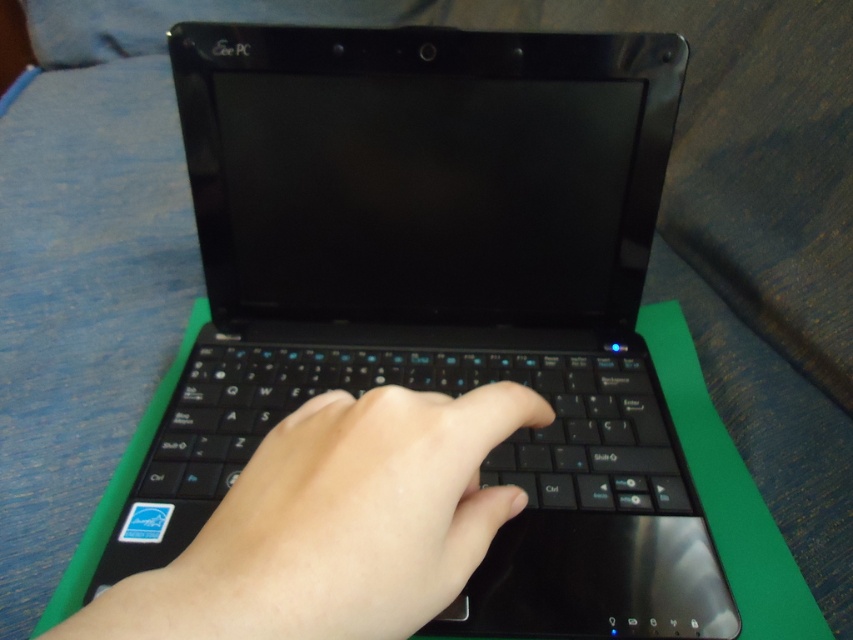
Is matte black hand at center further to the viewer compared to black matte keyboard at center?

That is False.

Which is in front, point (421, 516) or point (616, 388)?

Point (421, 516)

Identify the location of matte black hand at center. This screenshot has height=640, width=853. (350, 518).